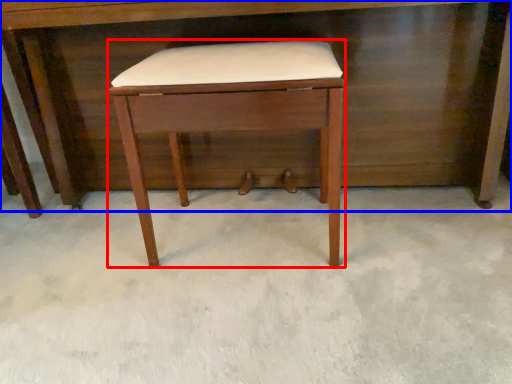
Question: Among these objects, which one is farthest to the camera, stool (highlighted by a red box) or desk (highlighted by a blue box)?

Choices:
 (A) stool
 (B) desk

Answer: (B)